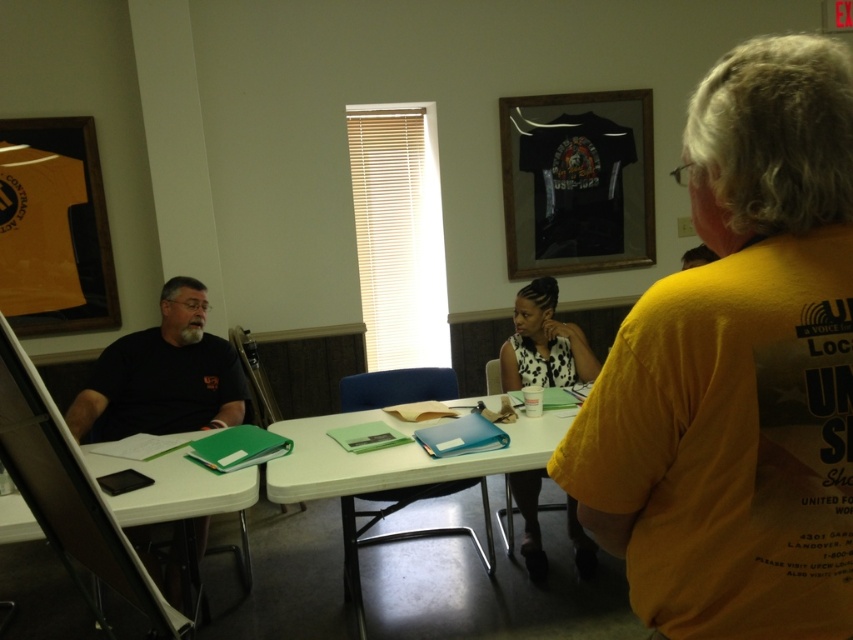
From the picture: You are a delivery robot with a package that measures 20 inches in length. You need to place the package between the white plastic table at center and the green plastic folder at lower left. Is there enough space to fit the package between them?

The distance between the white plastic table at center and the green plastic folder at lower left is 19.45 inches, which is slightly shorter than the 20 inches package. Therefore, the package may not fit comfortably between them without overlapping.

You are standing in the room and see the point at coordinates (392, 474). Which object is this point located on?

The point at coordinates (392, 474) is located on the white plastic table at center.